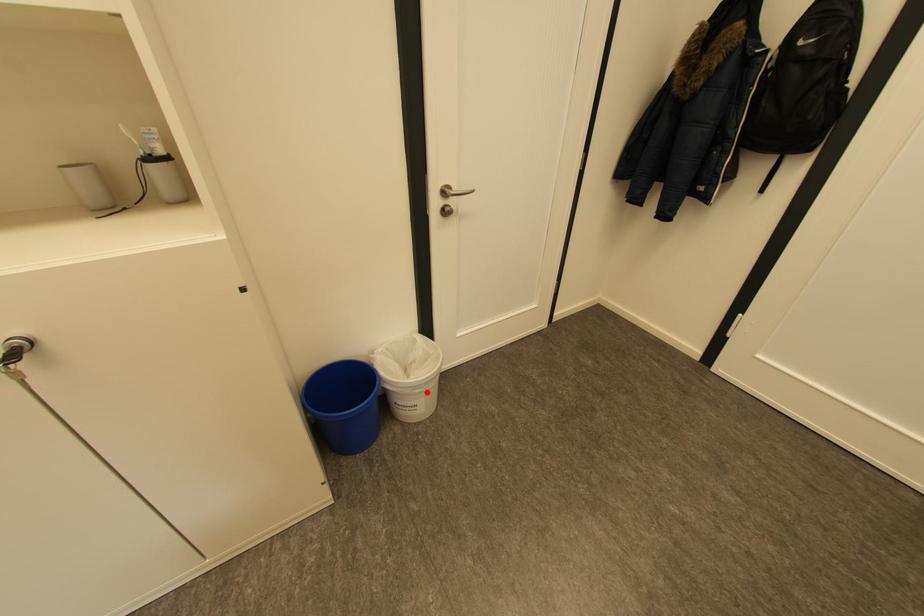
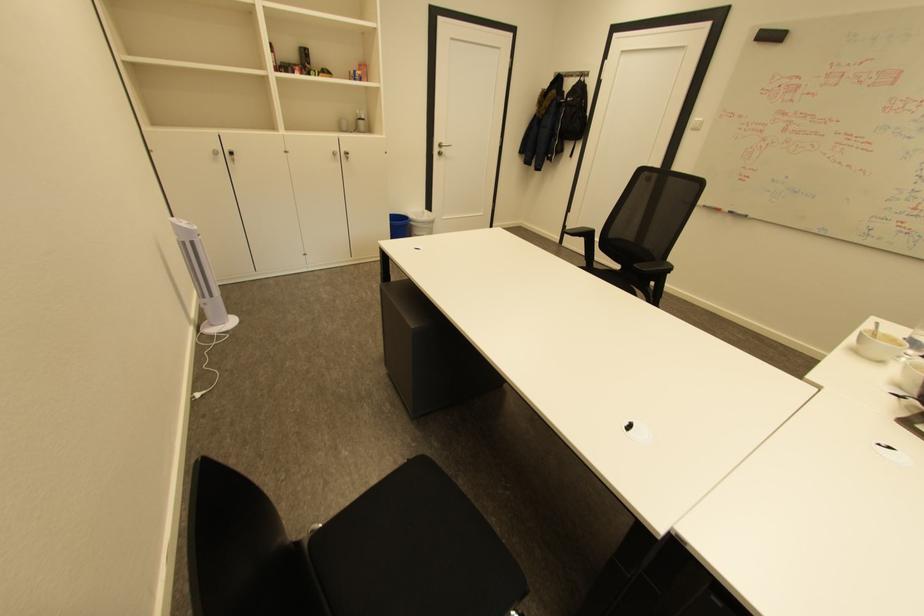
Question: I am providing you with two images of the same scene from different viewpoints. Image1 has a red point marked. In image2, the corresponding 3D location appears at what relative position? Reply with the corresponding letter.

Choices:
 (A) Closer
 (B) Farther

Answer: (A)